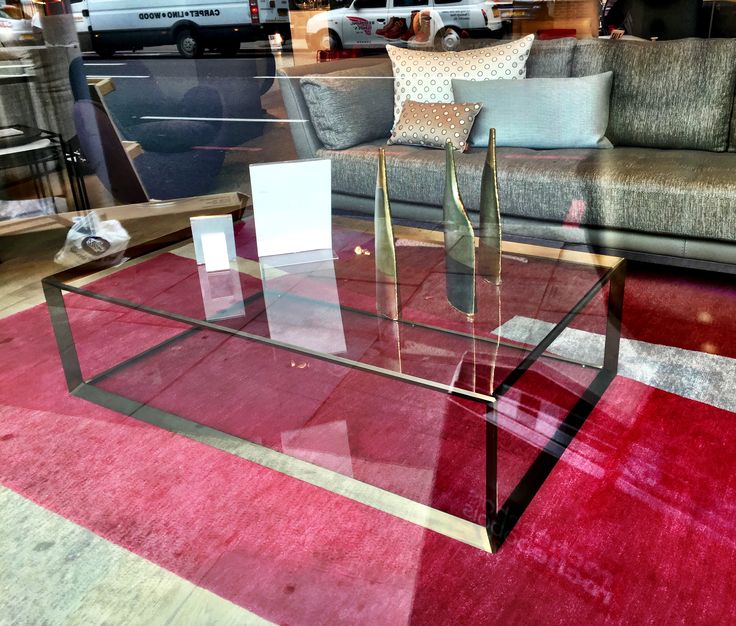
Locate an element on the screen. The image size is (736, 626). chairs or seating is located at coordinates (687, 130), (113, 166), (447, 74).